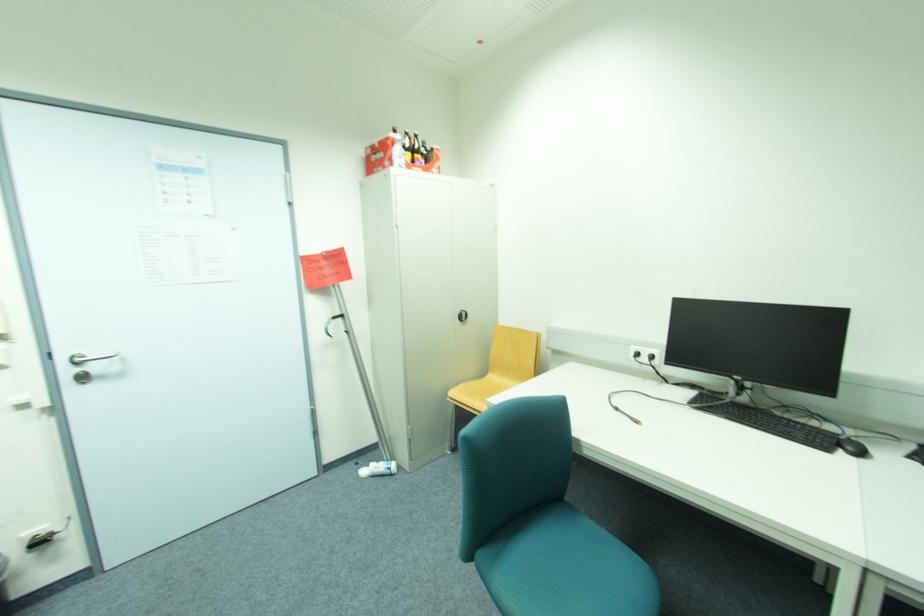
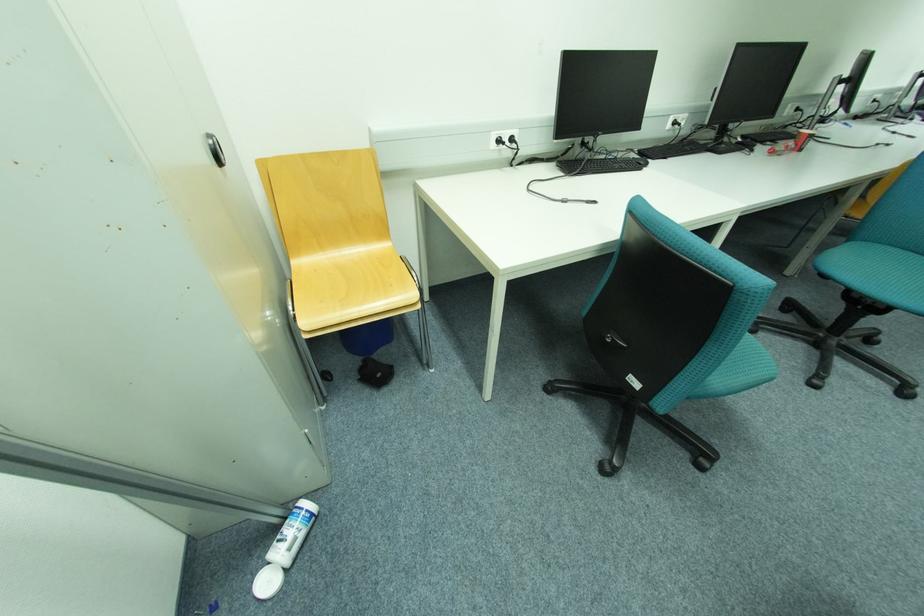
Locate, in the second image, the point that corresponds to the point at 371,472 in the first image.

(274, 584)